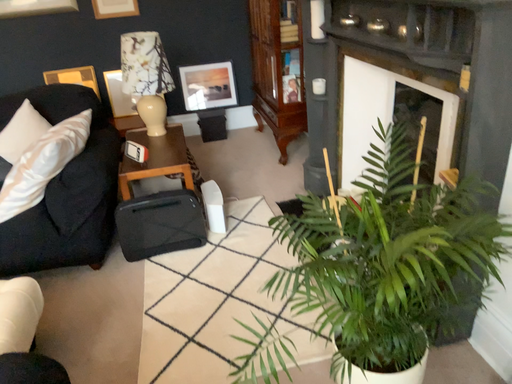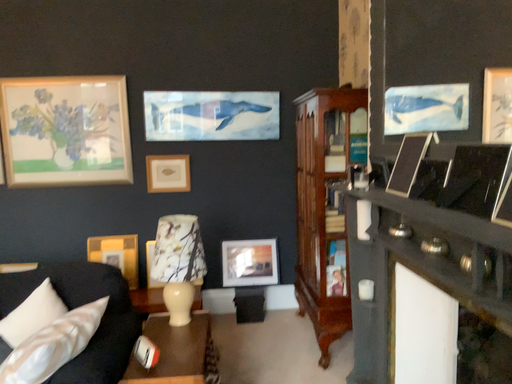
Question: How did the camera likely rotate when shooting the video?

Choices:
 (A) rotated upward
 (B) rotated downward

Answer: (A)